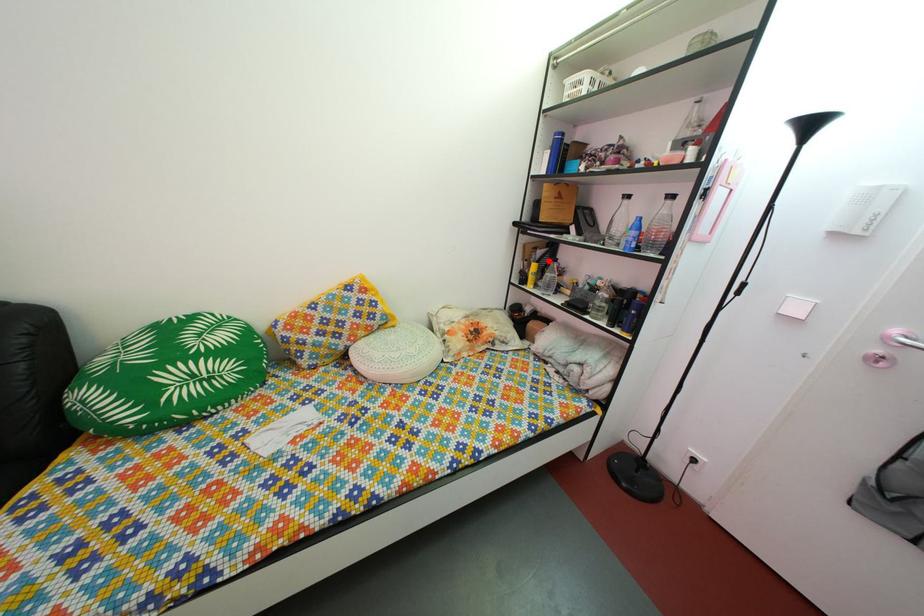
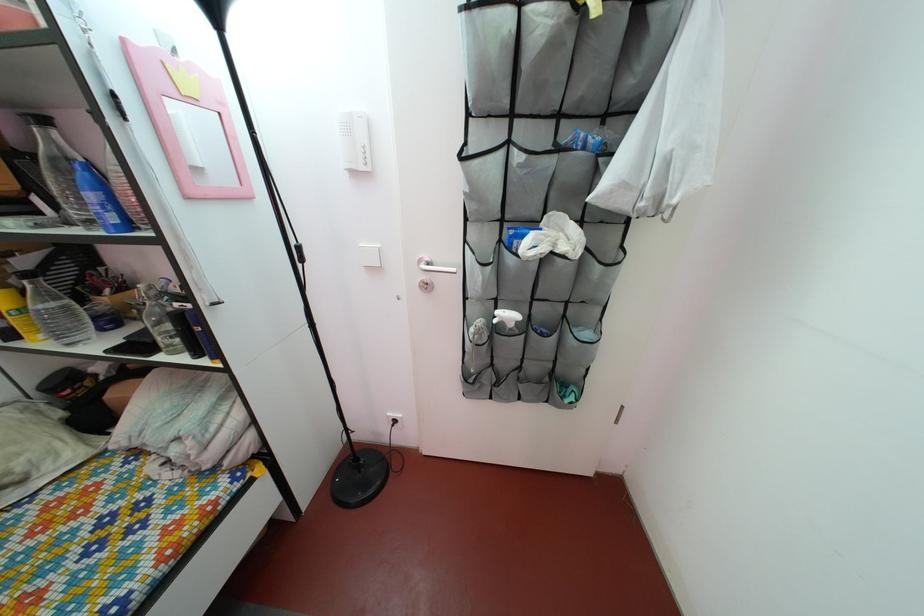
Where in the second image is the point corresponding to the highlighted location from the first image?

(32, 270)